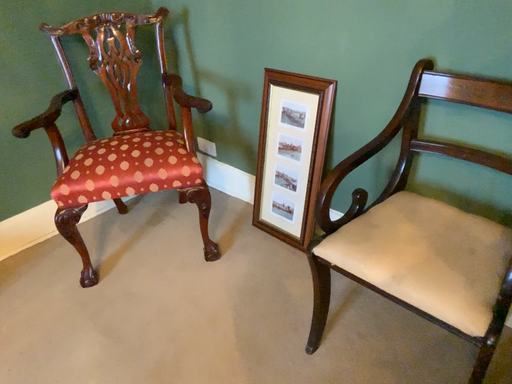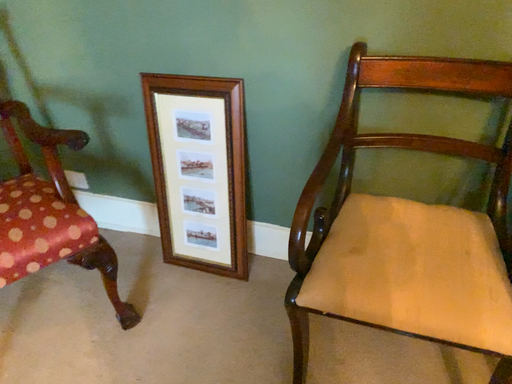
Question: Which way did the camera rotate in the video?

Choices:
 (A) rotated left
 (B) rotated right

Answer: (B)